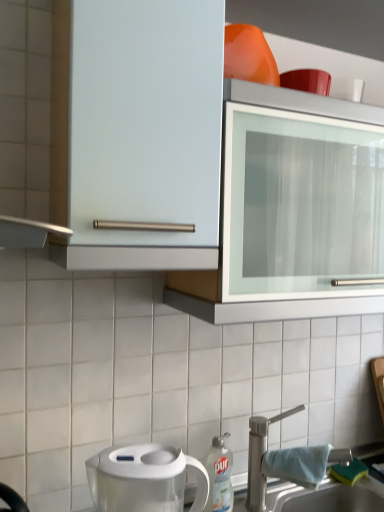
Question: From a real-world perspective, does white metallic tap at lower right sit lower than transparent plastic water filter pitcher at lower left?

Choices:
 (A) yes
 (B) no

Answer: (A)

Question: Is white metallic tap at lower right turned away from transparent plastic water filter pitcher at lower left?

Choices:
 (A) yes
 (B) no

Answer: (B)

Question: From the image's perspective, is white metallic tap at lower right below transparent plastic water filter pitcher at lower left?

Choices:
 (A) yes
 (B) no

Answer: (A)

Question: From a real-world perspective, is white metallic tap at lower right on transparent plastic water filter pitcher at lower left?

Choices:
 (A) no
 (B) yes

Answer: (A)

Question: Can we say white metallic tap at lower right lies outside transparent plastic water filter pitcher at lower left?

Choices:
 (A) no
 (B) yes

Answer: (B)

Question: Is transparent plastic water filter pitcher at lower left inside the boundaries of white ceramic sink at lower right, or outside?

Choices:
 (A) inside
 (B) outside

Answer: (B)

Question: From the image's perspective, is transparent plastic water filter pitcher at lower left above or below white ceramic sink at lower right?

Choices:
 (A) below
 (B) above

Answer: (B)

Question: Relative to white ceramic sink at lower right, is transparent plastic water filter pitcher at lower left in front or behind?

Choices:
 (A) front
 (B) behind

Answer: (A)

Question: Is transparent plastic water filter pitcher at lower left wider or thinner than white ceramic sink at lower right?

Choices:
 (A) thin
 (B) wide

Answer: (B)

Question: Is white plastic dish soap bottle at lower center in front of or behind white metallic tap at lower right in the image?

Choices:
 (A) front
 (B) behind

Answer: (B)

Question: Considering the relative positions of white plastic dish soap bottle at lower center and white metallic tap at lower right in the image provided, is white plastic dish soap bottle at lower center to the left or to the right of white metallic tap at lower right?

Choices:
 (A) left
 (B) right

Answer: (A)

Question: Considering the positions of white plastic dish soap bottle at lower center and white metallic tap at lower right in the image, is white plastic dish soap bottle at lower center taller or shorter than white metallic tap at lower right?

Choices:
 (A) short
 (B) tall

Answer: (A)

Question: From a real-world perspective, is white plastic dish soap bottle at lower center above or below white metallic tap at lower right?

Choices:
 (A) below
 (B) above

Answer: (A)

Question: Which is correct: white metallic tap at lower right is inside white plastic dish soap bottle at lower center, or outside of it?

Choices:
 (A) inside
 (B) outside

Answer: (B)

Question: From the image's perspective, is white metallic tap at lower right located above or below white plastic dish soap bottle at lower center?

Choices:
 (A) below
 (B) above

Answer: (B)